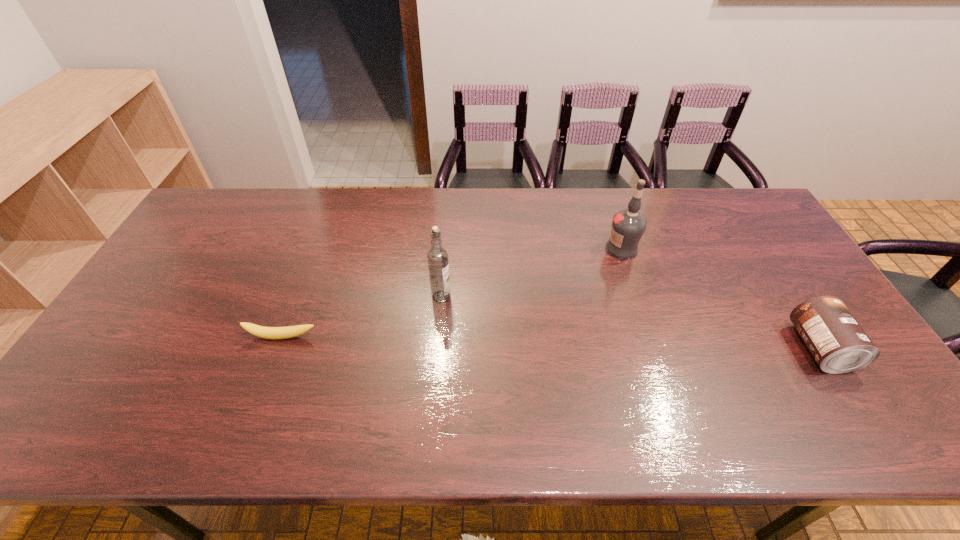
Where is `vacant region at the right edge`? vacant region at the right edge is located at coordinates 750,235.

This screenshot has width=960, height=540. In order to click on vacant space at the far right corner of the desktop in this screenshot , I will do `click(732, 219)`.

In order to click on free space between the second object from left to right and the rightmost object in this screenshot , I will do `click(631, 322)`.

Locate an element on the screen. This screenshot has width=960, height=540. free space between the left vodka and the can is located at coordinates (631, 322).

The width and height of the screenshot is (960, 540). In order to click on empty space that is in between the farther vodka and the can in this screenshot , I will do `click(720, 299)`.

This screenshot has height=540, width=960. I want to click on vacant area between the can and the left vodka, so click(x=631, y=322).

This screenshot has width=960, height=540. I want to click on unoccupied area between the farther vodka and the rightmost object, so click(720, 299).

The image size is (960, 540). In order to click on free point between the banana and the can in this screenshot , I will do `click(551, 343)`.

Where is `free space between the farther vodka and the can`? The width and height of the screenshot is (960, 540). free space between the farther vodka and the can is located at coordinates (720, 299).

What are the coordinates of `empty location between the third object from right to left and the shortest object` in the screenshot? It's located at (362, 317).